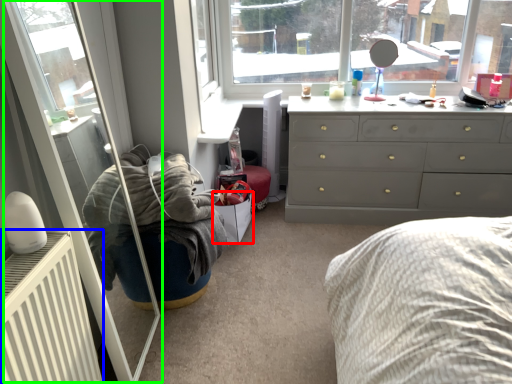
Question: Based on their relative distances, which object is nearer to shoe box (highlighted by a red box)? Choose from radiator (highlighted by a blue box) and screen door (highlighted by a green box).

Choices:
 (A) radiator
 (B) screen door

Answer: (B)